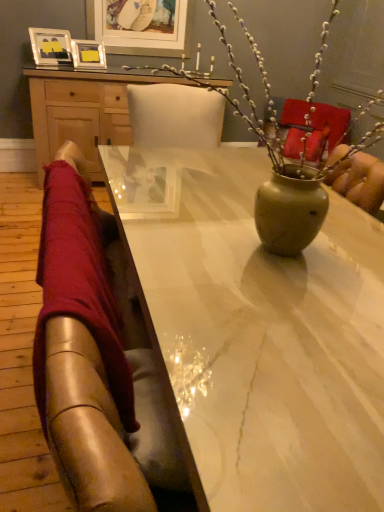
Question: Is point (130, 53) positioned closer to the camera than point (94, 477)?

Choices:
 (A) closer
 (B) farther

Answer: (B)

Question: From the image's perspective, relative to denim jeans at left, is matte white picture frame at upper center, marked as the 3th picture frame in a left-to-right arrangement, above or below?

Choices:
 (A) above
 (B) below

Answer: (A)

Question: Which object is positioned closest to the white marble table at center?

Choices:
 (A) matte white picture frame at upper center, marked as the 3th picture frame in a left-to-right arrangement
 (B) wooden desk at upper center
 (C) matte silver picture frame at upper left, which appears as the 3th picture frame when viewed from the right
 (D) matte silver picture frame at upper left, marked as the 2th picture frame in a left-to-right arrangement
 (E) matte green vase at center

Answer: (E)

Question: Estimate the real-world distances between objects in this image. Which object is farther from the matte white picture frame at upper center, marked as the 3th picture frame in a left-to-right arrangement?

Choices:
 (A) matte green vase at center
 (B) denim jeans at left
 (C) matte silver picture frame at upper left, which appears as the second picture frame when viewed from the right
 (D) white marble table at center
 (E) wooden desk at upper center

Answer: (B)